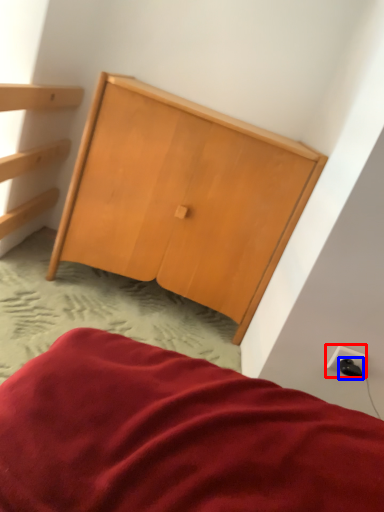
Question: Which object is closer to the camera taking this photo, electric outlet (highlighted by a red box) or plug (highlighted by a blue box)?

Choices:
 (A) electric outlet
 (B) plug

Answer: (B)